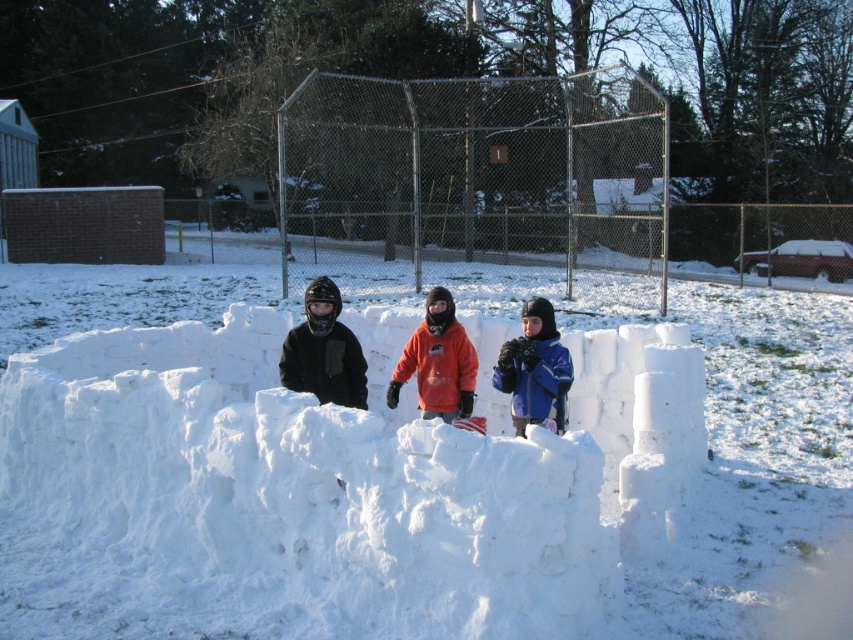
Question: Which object appears closest to the camera in this image?

Choices:
 (A) orange fleece jacket at center
 (B) white fluffy snow at center
 (C) matte black jacket at center

Answer: (B)

Question: Considering the real-world distances, which object is farthest from the blue fleece jacket at center?

Choices:
 (A) orange fleece jacket at center
 (B) white fluffy snow at center
 (C) matte black jacket at center

Answer: (B)

Question: Which point is farther from the camera taking this photo?

Choices:
 (A) (523, 301)
 (B) (454, 380)
 (C) (704, 611)

Answer: (A)

Question: Can you confirm if orange fleece jacket at center is wider than blue fleece jacket at center?

Choices:
 (A) no
 (B) yes

Answer: (B)

Question: Is orange fleece jacket at center wider than blue fleece jacket at center?

Choices:
 (A) yes
 (B) no

Answer: (A)

Question: Is white fluffy snow at center to the right of orange fleece jacket at center from the viewer's perspective?

Choices:
 (A) yes
 (B) no

Answer: (A)